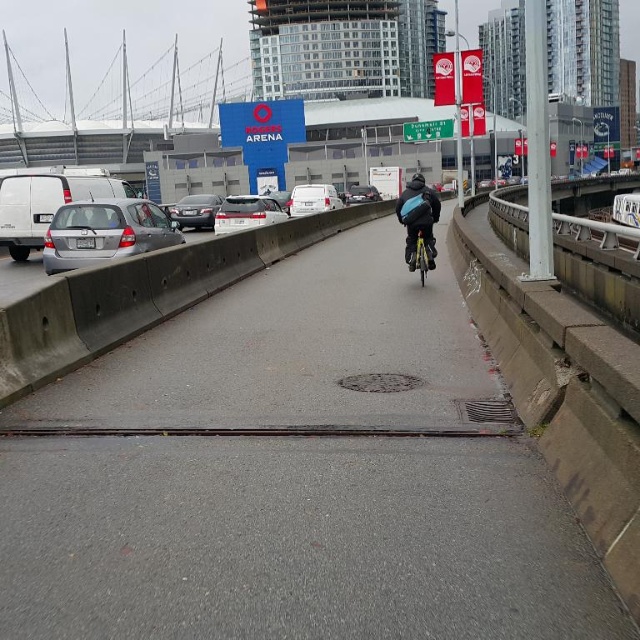
You are a cyclist planning to cross the gray concrete highway at center. There is a satin silver sedan at left in your path. Based on the scene, can you safely pass in front of the sedan?

The gray concrete highway at center is in front of the satin silver sedan at left, meaning the highway is ahead of the sedan. Since the sedan is behind the highway from your perspective, you can safely pass in front of the sedan as it is not blocking your path.

You are a cyclist planning to overtake both the satin silver sedan at center and the shiny silver car at center on the multi lane road. The minimum safe distance required to overtake is 15 meters. Can you safely overtake both vehicles at the same time?

The distance between the satin silver sedan at center and the shiny silver car at center is 10.81 meters, which is less than the required 15 meters for a safe overtake. Therefore, you cannot safely overtake both vehicles at the same time.